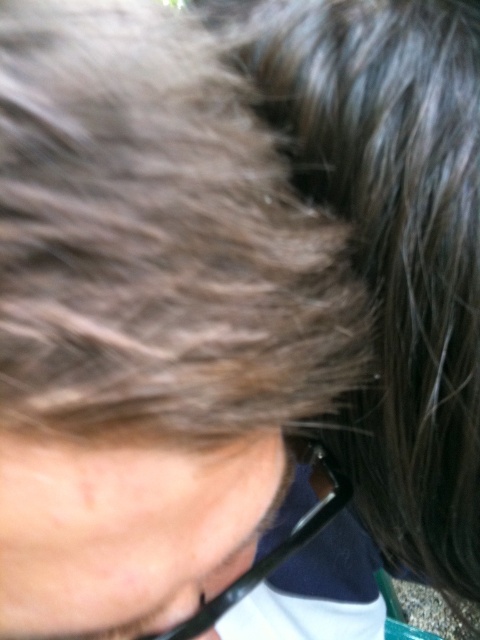
Based on the scene description, can you determine if the dark brown hair at upper right is covering any part of the black plastic glasses at lower center?

The dark brown hair at upper right is positioned over the black plastic glasses at lower center, so yes, the dark brown hair at upper right is covering part of the black plastic glasses at lower center.

Looking at this image, you are taking a photo of two points, point (279, 84) and point (107, 516). If you want to focus on the point that is closer to the camera, which point should you choose?

Point (107, 516) is closer to the camera than point (279, 84), so you should focus on point (107, 516).

Based on the scene description, which object, the dark brown hair at upper right or the black plastic glasses at lower center, occupies more vertical space in the image?

The dark brown hair at upper right has a greater height compared to the black plastic glasses at lower center, so it occupies more vertical space.